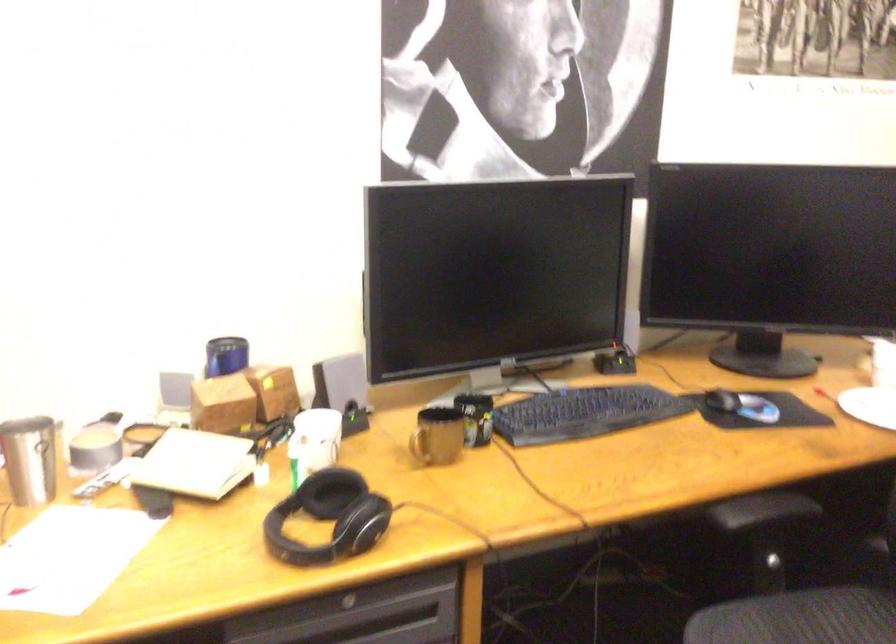
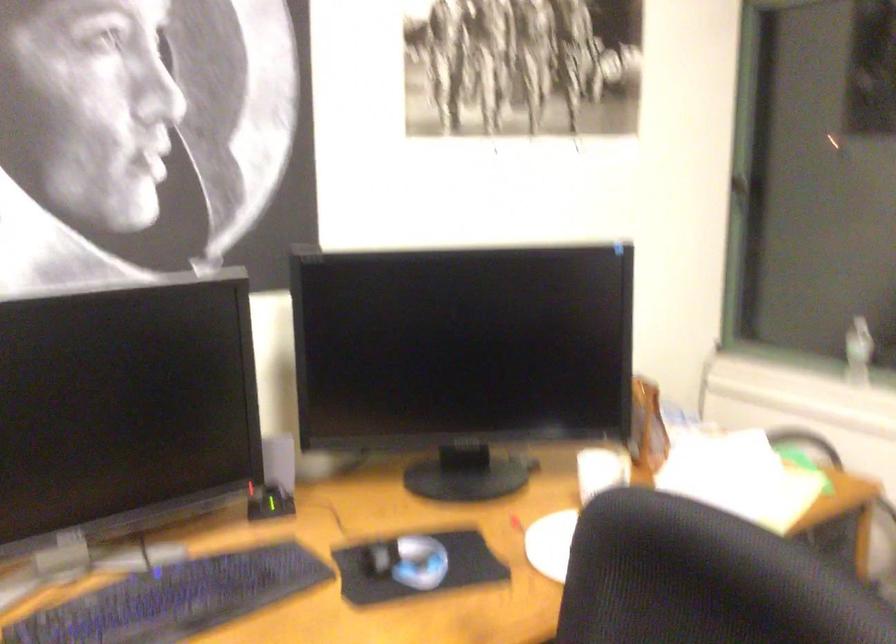
Consider the image. Which direction would the cameraman need to move to produce the second image?

The cameraman moved toward right, forward.